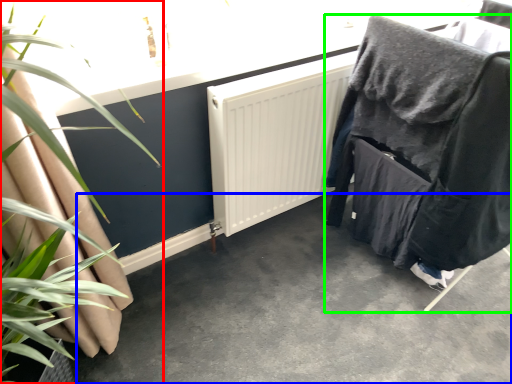
Question: Which is nearer to the houseplant (highlighted by a red box)? concrete (highlighted by a blue box) or furniture (highlighted by a green box).

Choices:
 (A) concrete
 (B) furniture

Answer: (A)